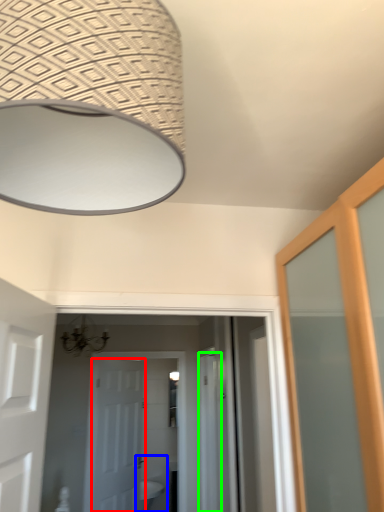
Question: Which object is the farthest from door (highlighted by a red box)? Choose among these: sink (highlighted by a blue box) or screen door (highlighted by a green box).

Choices:
 (A) sink
 (B) screen door

Answer: (B)